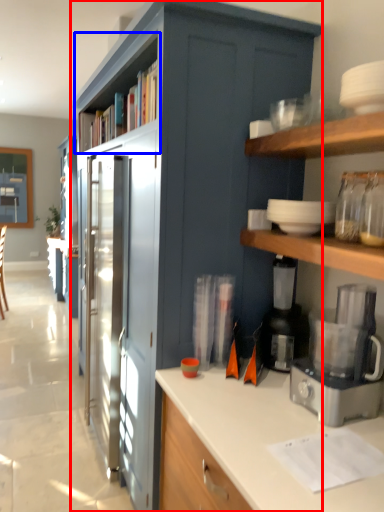
Question: Which point is closer to the camera, cabinetry (highlighted by a red box) or shelf (highlighted by a blue box)?

Choices:
 (A) cabinetry
 (B) shelf

Answer: (A)